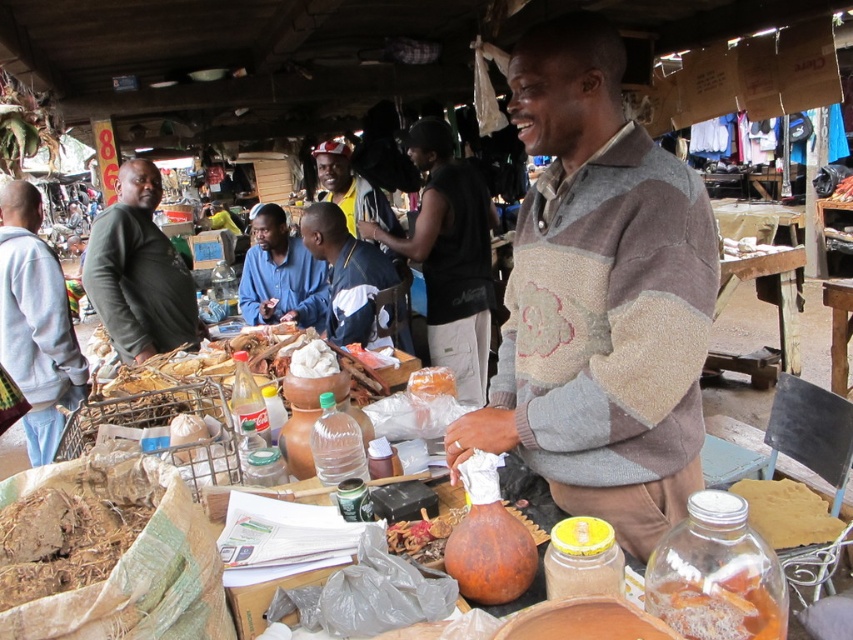
You are a customer at the market and want to place an order. You need to know which item is smaller between the blue cotton shirt at center and the wooden table at center. Can you help me?

The blue cotton shirt at center is smaller than the wooden table at center according to the description.

You are a customer at the market and want to place an order. You need to put a large package on the gray sweatshirt at left and the wooden table at center. Which object can hold the package more securely?

The wooden table at center can hold the package more securely since it has a larger size compared to the gray sweatshirt at left.

Based on the photo, you are a customer at the market and want to find the dark green sweater at left. According to the coordinates provided, where should you look to find it?

The dark green sweater at left is located at coordinates point (138, 273).